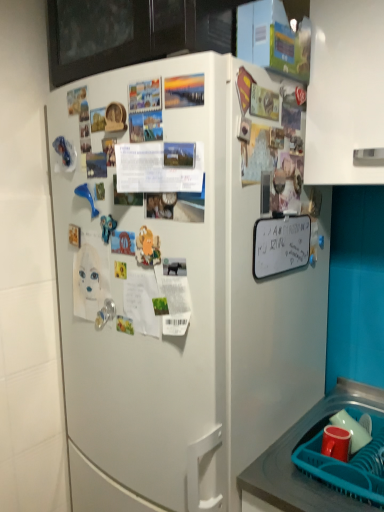
Question: Is teal plastic basket at lower right smaller than white matte refrigerator at center?

Choices:
 (A) yes
 (B) no

Answer: (A)

Question: From the image's perspective, is teal plastic basket at lower right above white matte refrigerator at center?

Choices:
 (A) yes
 (B) no

Answer: (B)

Question: Is teal plastic basket at lower right behind white matte refrigerator at center?

Choices:
 (A) no
 (B) yes

Answer: (B)

Question: From a real-world perspective, is teal plastic basket at lower right positioned under white matte refrigerator at center based on gravity?

Choices:
 (A) yes
 (B) no

Answer: (A)

Question: Is teal plastic basket at lower right next to white matte refrigerator at center?

Choices:
 (A) no
 (B) yes

Answer: (A)

Question: Considering their positions, is smooth plastic tray at lower right located in front of or behind matte red cup at lower right?

Choices:
 (A) front
 (B) behind

Answer: (A)

Question: From the image's perspective, is smooth plastic tray at lower right positioned above or below matte red cup at lower right?

Choices:
 (A) below
 (B) above

Answer: (A)

Question: Based on their sizes in the image, would you say smooth plastic tray at lower right is bigger or smaller than matte red cup at lower right?

Choices:
 (A) small
 (B) big

Answer: (B)

Question: In terms of width, does smooth plastic tray at lower right look wider or thinner when compared to matte red cup at lower right?

Choices:
 (A) wide
 (B) thin

Answer: (A)

Question: From the image's perspective, is white matte refrigerator at center located above or below smooth plastic tray at lower right?

Choices:
 (A) below
 (B) above

Answer: (B)

Question: In terms of height, does white matte refrigerator at center look taller or shorter compared to smooth plastic tray at lower right?

Choices:
 (A) tall
 (B) short

Answer: (A)

Question: In terms of width, does white matte refrigerator at center look wider or thinner when compared to smooth plastic tray at lower right?

Choices:
 (A) thin
 (B) wide

Answer: (B)

Question: Relative to smooth plastic tray at lower right, is white matte refrigerator at center in front or behind?

Choices:
 (A) front
 (B) behind

Answer: (A)

Question: In the image, is matte red cup at lower right positioned in front of or behind white matte dry erase board at upper right, the third poster positioned from the top?

Choices:
 (A) front
 (B) behind

Answer: (B)

Question: Is matte red cup at lower right spatially inside white matte dry erase board at upper right, placed as the third poster when sorted from front to back, or outside of it?

Choices:
 (A) outside
 (B) inside

Answer: (A)